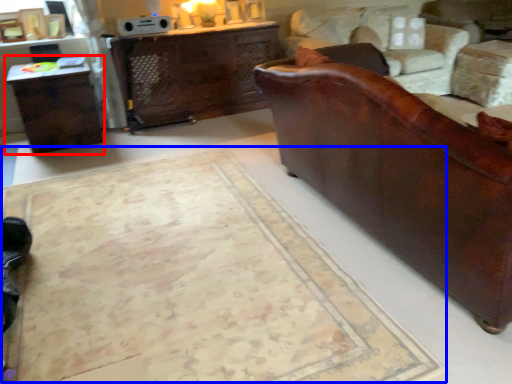
Question: Which object is closer to the camera taking this photo, table (highlighted by a red box) or mat (highlighted by a blue box)?

Choices:
 (A) table
 (B) mat

Answer: (B)